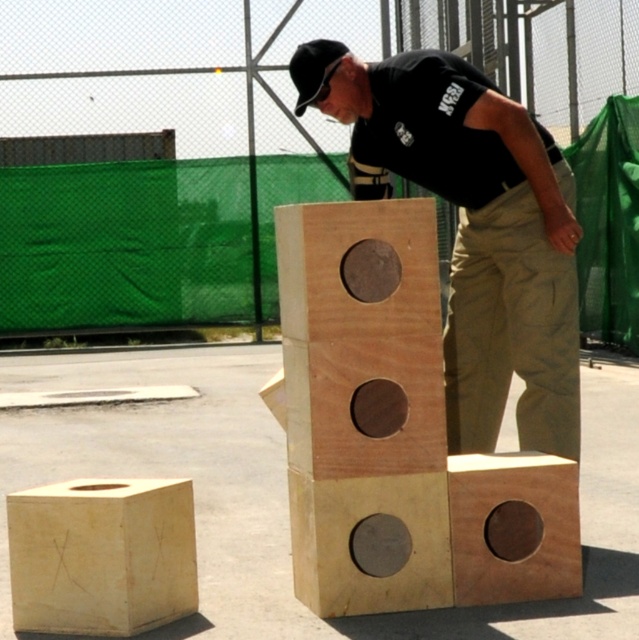
Is khaki pants at center bigger than light wood block at lower left?

Indeed, khaki pants at center has a larger size compared to light wood block at lower left.

Who is shorter, khaki pants at center or light wood block at lower left?

light wood block at lower left

Is point (450, 328) positioned behind point (173, 611)?

That is True.

Locate an element on the screen. The image size is (639, 640). khaki pants at center is located at coordinates (511, 330).

Is khaki pants at center wider than black matte baseball hat at upper center?

Correct, the width of khaki pants at center exceeds that of black matte baseball hat at upper center.

Can you confirm if khaki pants at center is shorter than black matte baseball hat at upper center?

Incorrect, khaki pants at center's height does not fall short of black matte baseball hat at upper center's.

Does point (566, 253) lie in front of point (304, 68)?

Yes.

This screenshot has width=639, height=640. Find the location of `khaki pants at center`. khaki pants at center is located at coordinates (511, 330).

In the scene shown: Can you confirm if light wood block at lower left is wider than natural wood block at center?

Yes.

Is light wood block at lower left thinner than natural wood block at center?

Incorrect, light wood block at lower left's width is not less than natural wood block at center's.

Which is behind, point (66, 502) or point (543, 490)?

Point (543, 490)

This screenshot has width=639, height=640. I want to click on light wood block at lower left, so click(x=102, y=556).